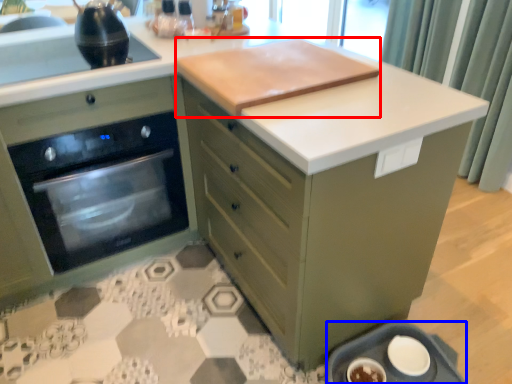
Question: Which object appears farthest to the camera in this image, wide (highlighted by a red box) or appliance (highlighted by a blue box)?

Choices:
 (A) wide
 (B) appliance

Answer: (B)